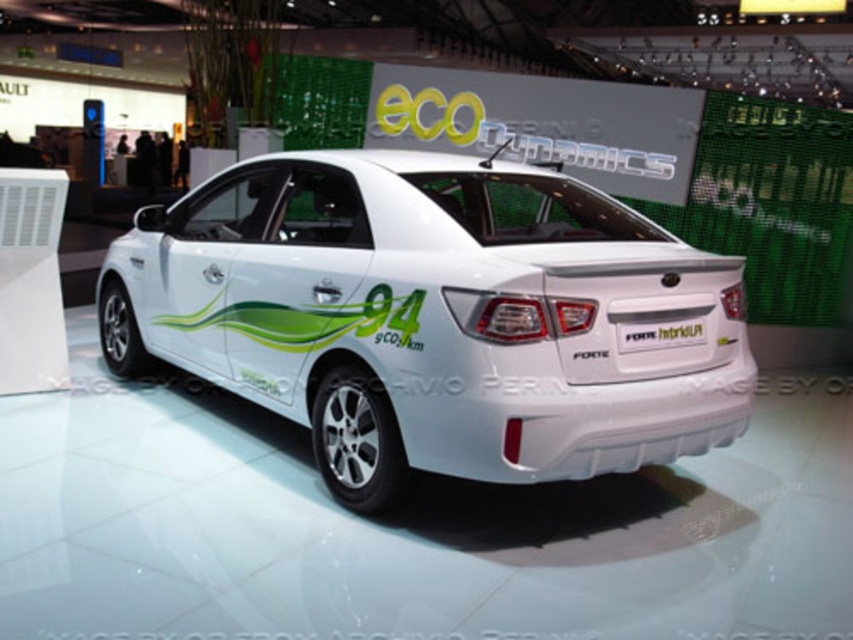
Can you confirm if white glossy car at center is shorter than white plastic license plate at center?

No, white glossy car at center is not shorter than white plastic license plate at center.

Is white glossy car at center taller than white plastic license plate at center?

Indeed, white glossy car at center has a greater height compared to white plastic license plate at center.

This screenshot has height=640, width=853. What do you see at coordinates (432, 316) in the screenshot? I see `white glossy car at center` at bounding box center [432, 316].

Where is `white glossy car at center`? white glossy car at center is located at coordinates (432, 316).